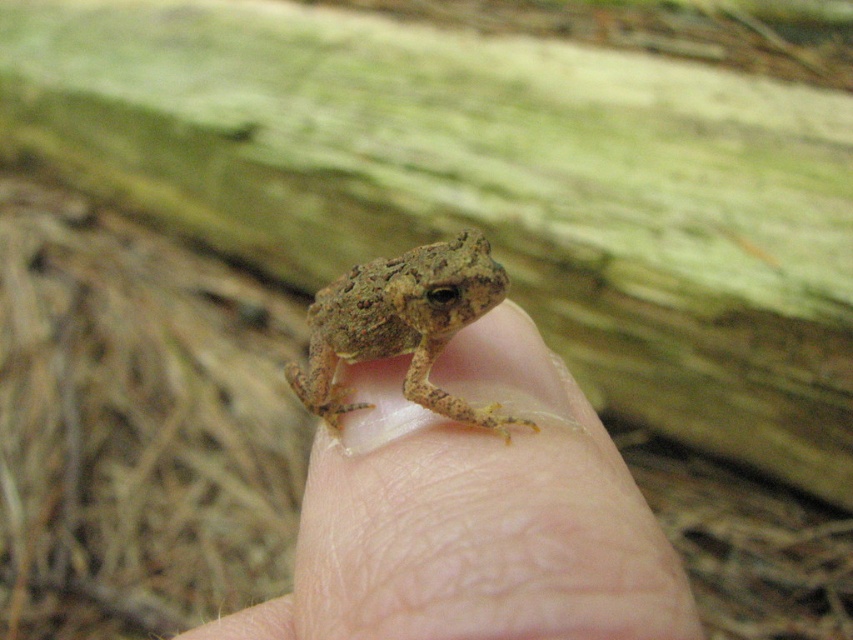
Question: Is the position of brown rough skin at center more distant than that of camouflage skin frog at center?

Choices:
 (A) no
 (B) yes

Answer: (A)

Question: In this image, where is brown rough skin at center located relative to camouflage skin frog at center?

Choices:
 (A) above
 (B) below

Answer: (B)

Question: Which object appears closest to the camera in this image?

Choices:
 (A) brown rough skin at center
 (B) camouflage skin frog at center

Answer: (A)

Question: Can you confirm if brown rough skin at center is wider than camouflage skin frog at center?

Choices:
 (A) yes
 (B) no

Answer: (A)

Question: Which object is closer to the camera taking this photo?

Choices:
 (A) brown rough skin at center
 (B) camouflage skin frog at center

Answer: (A)